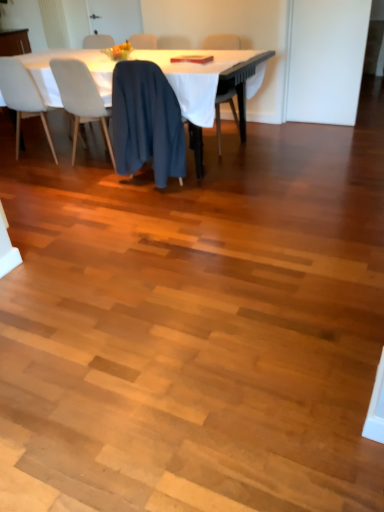
Question: Considering the positions of blue fabric chair at center, which is the third chair from right to left, and white cloth-covered table at upper center in the image, is blue fabric chair at center, which is the third chair from right to left, bigger or smaller than white cloth-covered table at upper center?

Choices:
 (A) small
 (B) big

Answer: (A)

Question: Visually, is blue fabric chair at center, the 2th chair when ordered from left to right, positioned to the left or to the right of white cloth-covered table at upper center?

Choices:
 (A) left
 (B) right

Answer: (A)

Question: Which of these objects is positioned farthest from the blue fabric chair at center, which is the third chair from right to left?

Choices:
 (A) dark blue fabric at center, placed as the third chair when sorted from left to right
 (B) white cloth-covered table at upper center
 (C) matte black chair at center, the fourth chair from the left
 (D) white fabric chair at left, the first chair viewed from the left

Answer: (C)

Question: Which object is positioned farthest from the blue fabric chair at center, the 2th chair when ordered from left to right?

Choices:
 (A) matte black chair at center, the fourth chair from the left
 (B) dark blue fabric at center, which is the second chair from right to left
 (C) white fabric chair at left, the first chair viewed from the left
 (D) white cloth-covered table at upper center

Answer: (A)